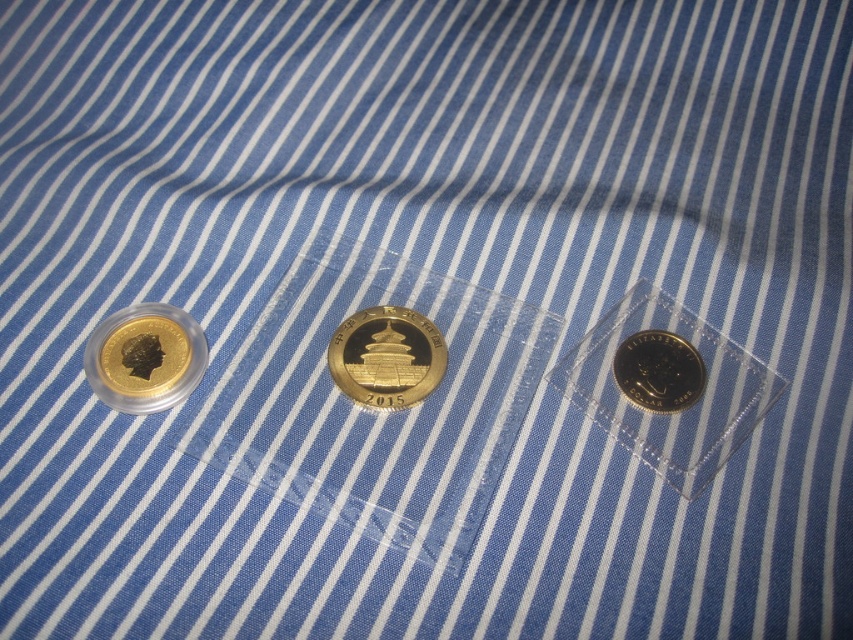
Based on the photo, measure the distance between gold plated coin at center and shiny silver coin at center.

The distance of gold plated coin at center from shiny silver coin at center is 12.52 inches.

Between gold plated coin at center and shiny silver coin at center, which one has more height?

With more height is gold plated coin at center.

Who is more distant from viewer, (x=422, y=317) or (x=705, y=380)?

The point (x=422, y=317) is more distant.

Locate an element on the screen. gold plated coin at center is located at coordinates (386, 356).

Which is more to the right, gold shiny coin at left or gold plated coin at center?

gold plated coin at center

Which is below, gold shiny coin at left or gold plated coin at center?

gold plated coin at center is below.

What are the coordinates of `gold shiny coin at left` in the screenshot? It's located at (144, 356).

Which of these two, gold coin in clear plastic at center-right or gold plated coin at center, stands taller?

With more height is gold coin in clear plastic at center-right.

Between point (659, 433) and point (354, 349), which one is positioned behind?

The point (354, 349) is more distant.

Find the location of a particular element. This screenshot has height=640, width=853. gold coin in clear plastic at center-right is located at coordinates (677, 401).

You are a GUI agent. You are given a task and a screenshot of the screen. Output one action in this format:
    pyautogui.click(x=<x>, y=<y>)
    Task: Click on the gold coin in clear plastic at center-right
    
    Given the screenshot: What is the action you would take?
    pyautogui.click(x=677, y=401)